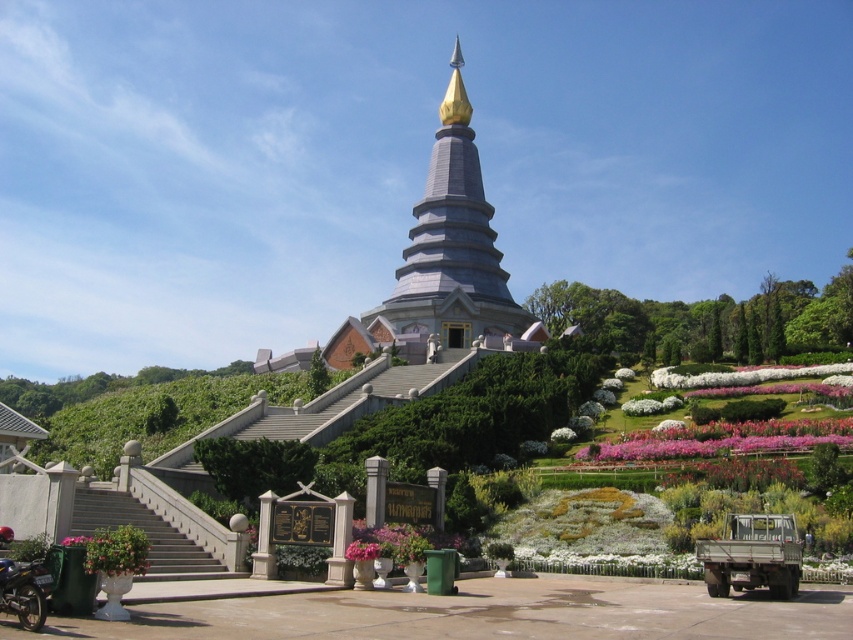
Question: Is the position of gray concrete stairs at lower left less distant than that of metallic silver motorcycle at lower left?

Choices:
 (A) yes
 (B) no

Answer: (B)

Question: Which of these objects is positioned closest to the pink fabric flower at lower left?

Choices:
 (A) gray concrete stairs at lower left
 (B) metallic silver motorcycle at lower left

Answer: (B)

Question: Does metallic silver motorcycle at lower left have a lesser width compared to pink fabric flower at lower left?

Choices:
 (A) no
 (B) yes

Answer: (B)

Question: Which is farther from the gray concrete stairs at lower left?

Choices:
 (A) pink fabric flower at lower left
 (B) metallic silver motorcycle at lower left

Answer: (B)

Question: Is gray concrete stairs at lower left to the left of metallic silver motorcycle at lower left from the viewer's perspective?

Choices:
 (A) yes
 (B) no

Answer: (A)

Question: Which is nearer to the pink fabric flower at lower left?

Choices:
 (A) metallic silver motorcycle at lower left
 (B) gray concrete stairs at lower left

Answer: (A)